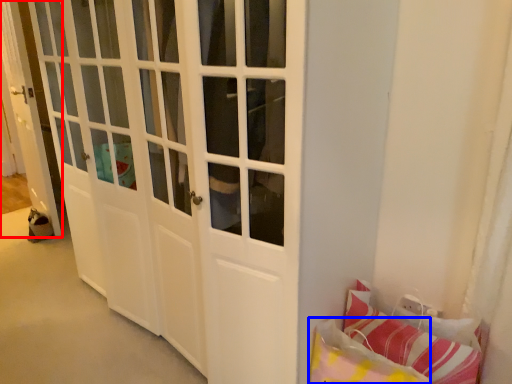
Question: Which of the following is the farthest to the observer, door (highlighted by a red box) or pillow (highlighted by a blue box)?

Choices:
 (A) door
 (B) pillow

Answer: (A)